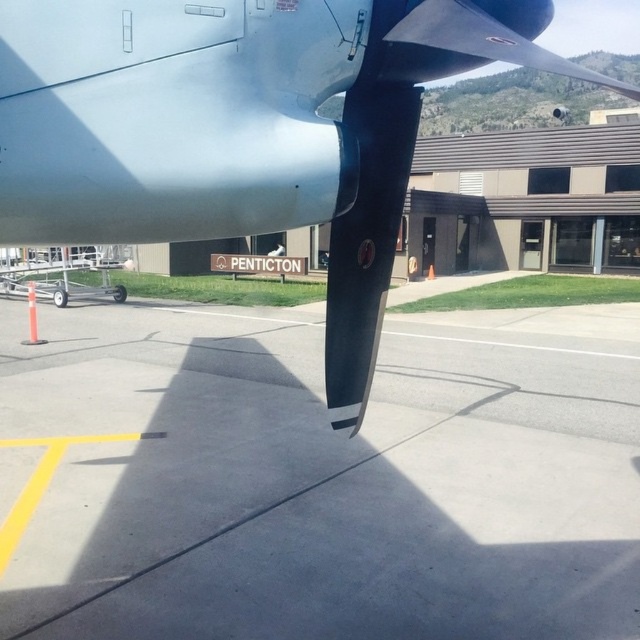
You are a pilot checking the runway conditions. You see the gray concrete tarmac at center and the polished aluminum propeller at center. Which object is taller?

The polished aluminum propeller at center is taller than the gray concrete tarmac at center.

You are standing at the point marked as point (321, 483) in the image. Looking around, you see the airplane propeller attached to the wing and the building with the word PENTICTON. What is directly beneath your feet at that point?

The gray concrete tarmac at center is directly beneath your feet at point (321, 483).

Based on the photo, you are a maintenance worker at the airport. You need to place a heavy tool box on the gray concrete tarmac at center. However, there is a polished aluminum propeller at center above it. Is there enough vertical space between them for you to safely place the box?

The gray concrete tarmac at center is located below the polished aluminum propeller at center, so there is vertical space between them. However, the exact clearance isn